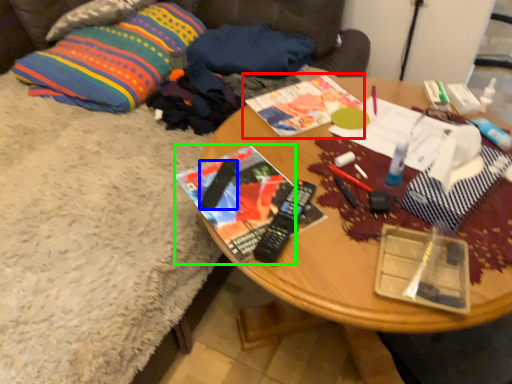
Question: Which is farther away from book (highlighted by a red box)? remote control (highlighted by a blue box) or magazine (highlighted by a green box)?

Choices:
 (A) remote control
 (B) magazine

Answer: (A)